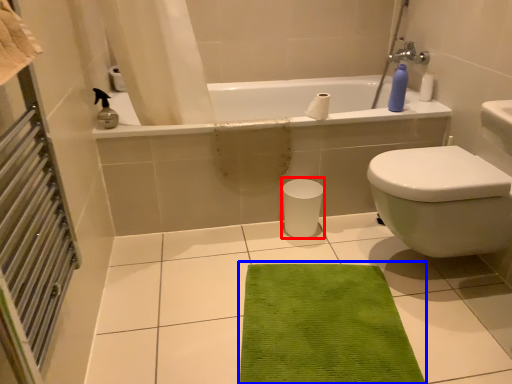
Question: Which point is further to the camera, porcelain (highlighted by a red box) or doormat (highlighted by a blue box)?

Choices:
 (A) porcelain
 (B) doormat

Answer: (A)